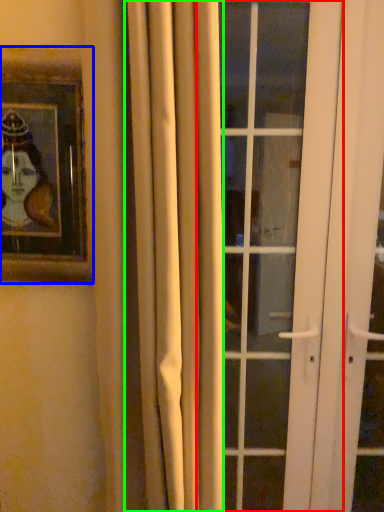
Question: Which object is the closest to the door (highlighted by a red box)? Choose among these: picture frame (highlighted by a blue box) or curtain (highlighted by a green box).

Choices:
 (A) picture frame
 (B) curtain

Answer: (B)